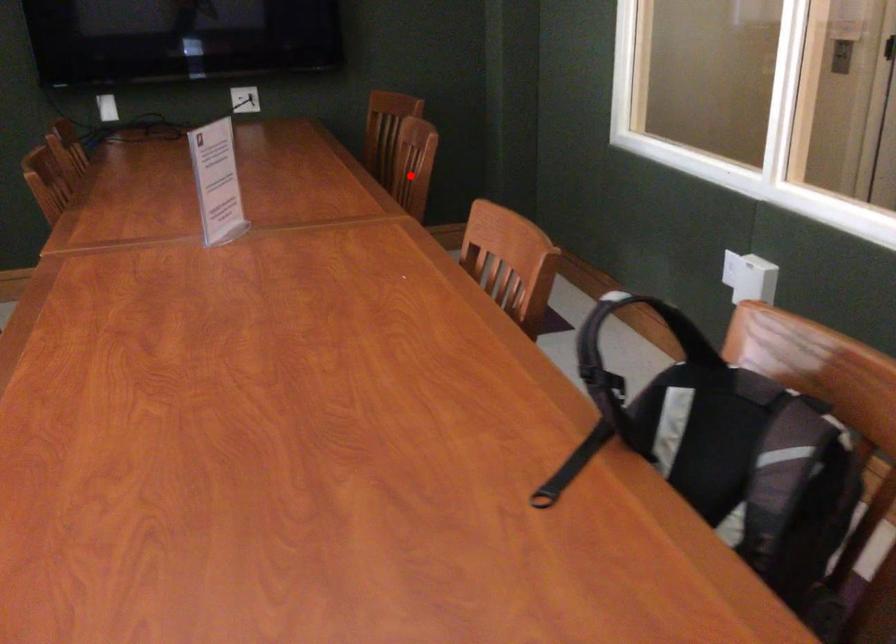
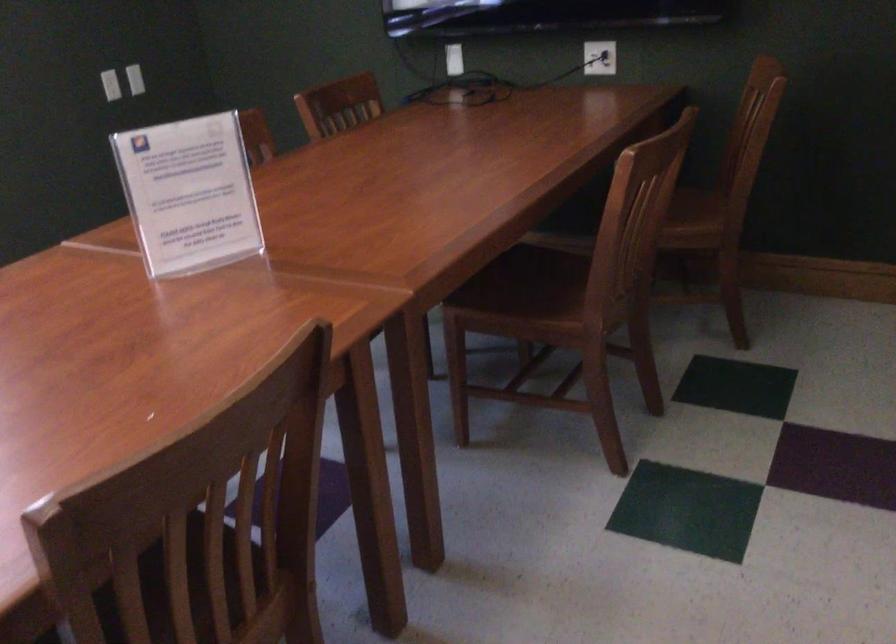
Where in the second image is the point corresponding to the highlighted location from the first image?

(668, 205)